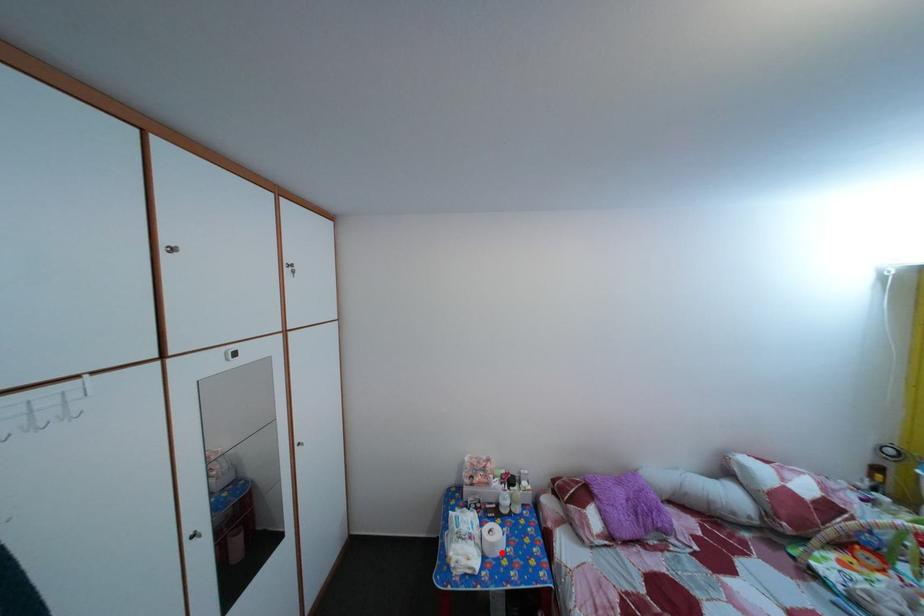
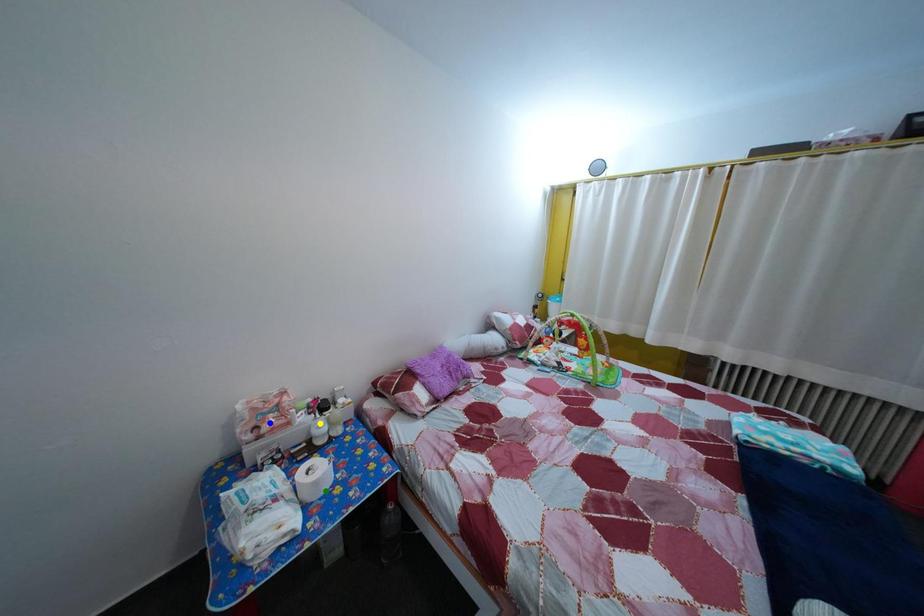
Question: I am providing you with two images of the same scene from different viewpoints. A red point is marked on the first image. You are given multiple points on the second image. Which point in image 2 represents the same 3d spot as the red point in image 1?

Choices:
 (A) blue point
 (B) green point
 (C) yellow point

Answer: (B)